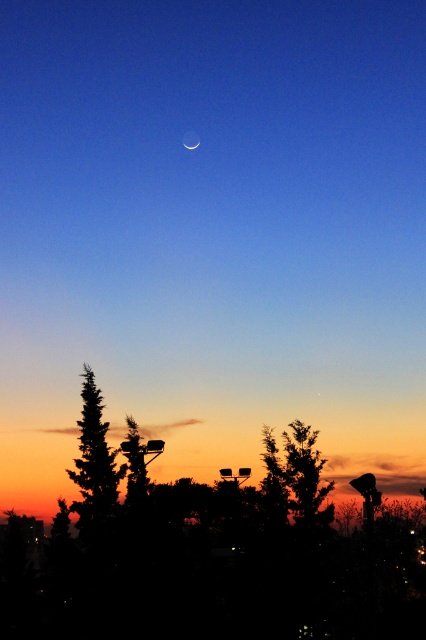
You are standing in the twilight scene and want to take a photo of both point (285, 499) and point (141, 460). Which point should you focus on first to ensure both are in clear view?

You should focus on point (285, 499) first because it is closer to the camera than point (141, 460). By focusing on the closer point, both points will be in focus due to the depth of field.

You are a bird flying at night and want to land between the green leafy tree at lower right and the green leafy tree at lower left. Can you fit comfortably in the space between them?

The green leafy tree at lower right and the green leafy tree at lower left are 9.08 meters apart, so yes, you can fit comfortably between them as the distance is sufficient for a bird to land.